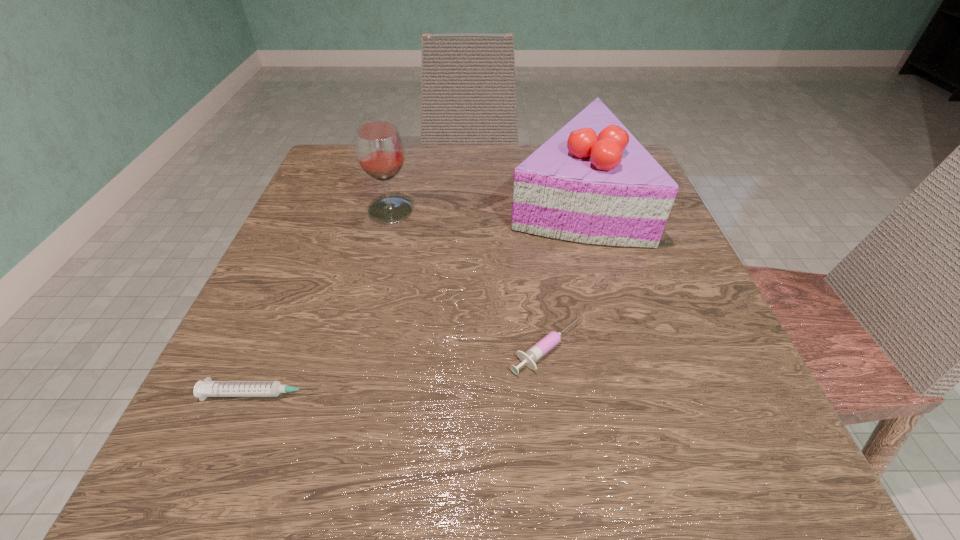
Image resolution: width=960 pixels, height=540 pixels. In order to click on cake that is at the far edge in this screenshot , I will do `click(592, 182)`.

The image size is (960, 540). Identify the location of wineglass present at the far edge. (379, 148).

This screenshot has height=540, width=960. I want to click on wineglass present at the left edge, so click(379, 148).

The image size is (960, 540). Find the location of `syringe located in the left edge section of the desktop`. syringe located in the left edge section of the desktop is located at coordinates (207, 388).

Where is `object at the right edge`? Image resolution: width=960 pixels, height=540 pixels. object at the right edge is located at coordinates tap(592, 182).

Locate an element on the screen. The image size is (960, 540). object that is at the far left corner is located at coordinates (379, 148).

At what (x,y) coordinates should I click in order to perform the action: click on object at the far right corner. Please return your answer as a coordinate pair (x, y). The image size is (960, 540). Looking at the image, I should click on (592, 182).

The image size is (960, 540). In the image, there is a desktop. Identify the location of free space at the far edge. (491, 194).

Locate an element on the screen. Image resolution: width=960 pixels, height=540 pixels. free space at the near edge is located at coordinates (367, 449).

You are a GUI agent. You are given a task and a screenshot of the screen. Output one action in this format:
    pyautogui.click(x=<x>, y=<y>)
    Task: Click on the free location at the left edge of the desktop
    
    Given the screenshot: What is the action you would take?
    pyautogui.click(x=245, y=354)